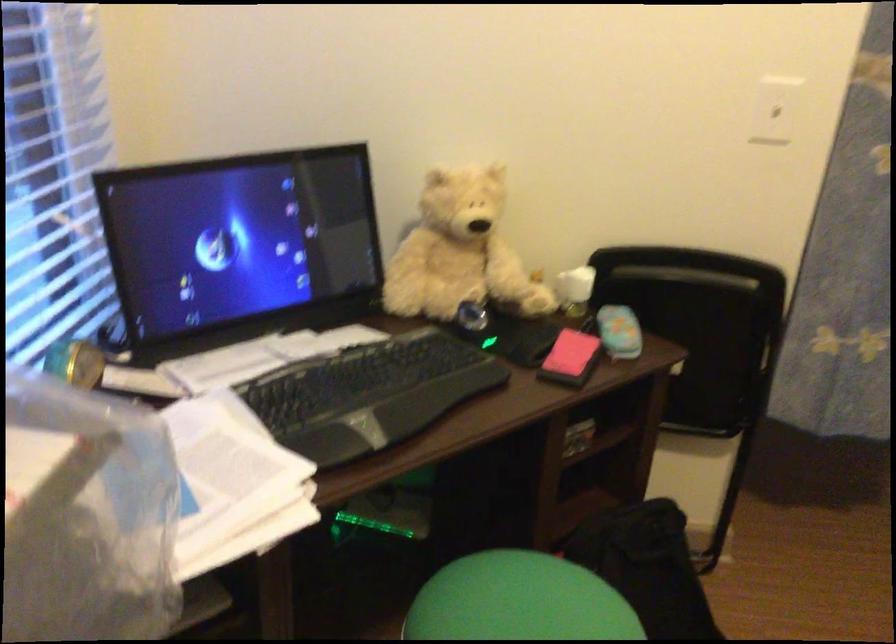
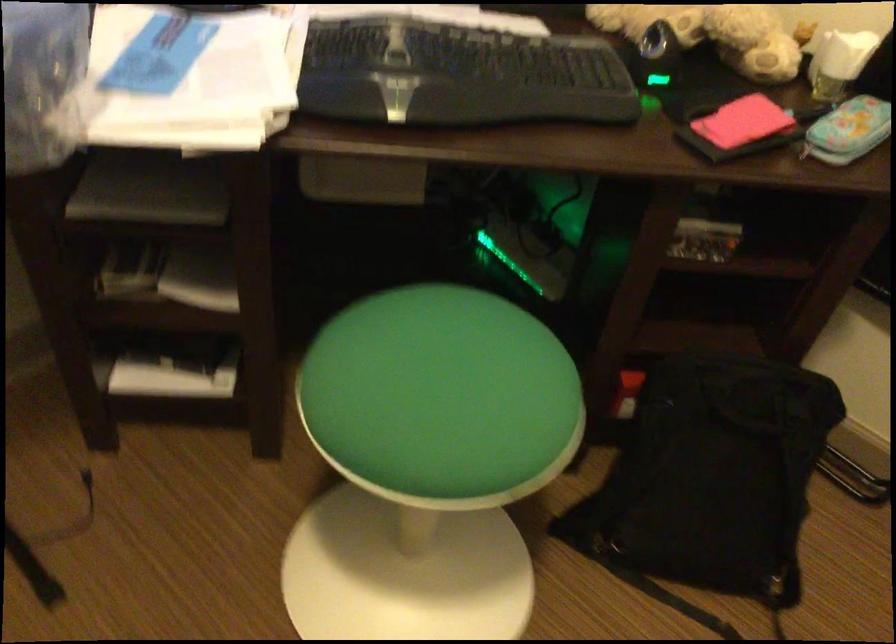
First-person continuous shooting, in which direction is the camera rotating?

The camera's rotation is toward left-down.